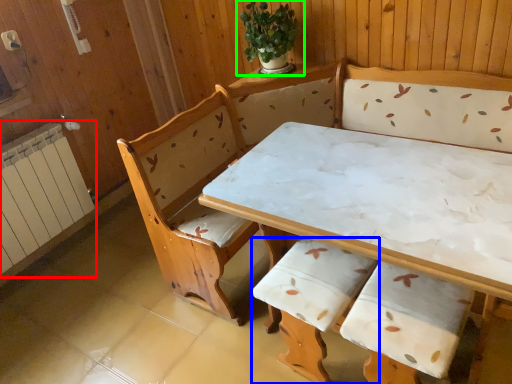
Question: Which object is the farthest from radiator (highlighted by a red box)? Choose among these: armchair (highlighted by a blue box) or houseplant (highlighted by a green box).

Choices:
 (A) armchair
 (B) houseplant

Answer: (A)